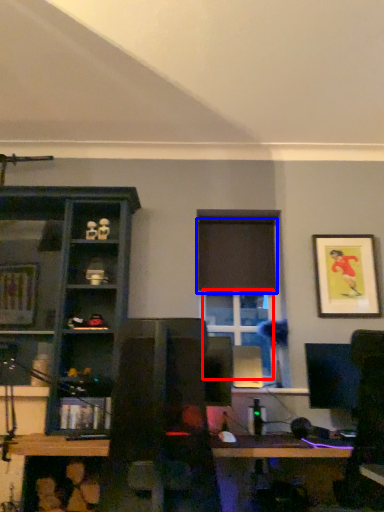
Question: Which of the following is the farthest to the observer, window (highlighted by a red box) or curtain (highlighted by a blue box)?

Choices:
 (A) window
 (B) curtain

Answer: (B)